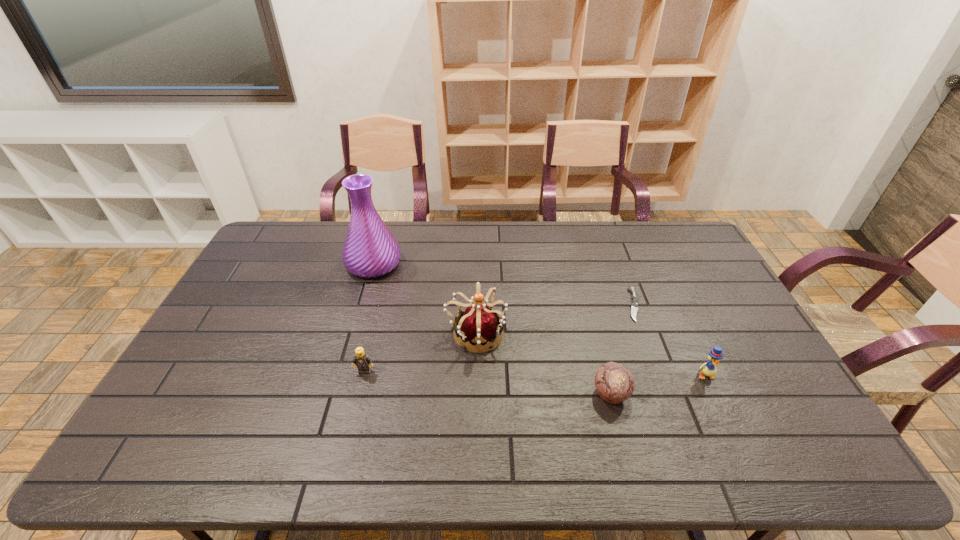
At what (x,y) coordinates should I click in order to perform the action: click on free space located 0.120m on the front-facing side of the fifth shortest object. Please return your answer as a coordinate pair (x, y). Looking at the image, I should click on click(546, 334).

Find the location of a particular element. This screenshot has width=960, height=540. free space located 0.050m on the face of the duckling, where the monocle is placed is located at coordinates (715, 397).

At what (x,y) coordinates should I click in order to perform the action: click on free space located in front of the Lego. Please return your answer as a coordinate pair (x, y). The width and height of the screenshot is (960, 540). Looking at the image, I should click on (360, 389).

Identify the location of vacant space located 0.290m on the left of the third object from right to left. The height and width of the screenshot is (540, 960). (483, 394).

Where is `free spot located on the front of the shortest object`? The height and width of the screenshot is (540, 960). free spot located on the front of the shortest object is located at coordinates (675, 415).

The image size is (960, 540). Find the location of `object that is at the far edge`. object that is at the far edge is located at coordinates (370, 250).

Where is `free space at the far edge of the desktop`? free space at the far edge of the desktop is located at coordinates (341, 241).

Image resolution: width=960 pixels, height=540 pixels. What are the coordinates of `vacant space at the near edge of the desktop` in the screenshot? It's located at (660, 461).

In the image, there is a desktop. At what (x,y) coordinates should I click in order to perform the action: click on vacant space at the left edge. Please return your answer as a coordinate pair (x, y). The image size is (960, 540). Looking at the image, I should click on (244, 313).

In the image, there is a desktop. At what (x,y) coordinates should I click in order to perform the action: click on blank space at the right edge. Please return your answer as a coordinate pair (x, y). This screenshot has width=960, height=540. Looking at the image, I should click on (692, 284).